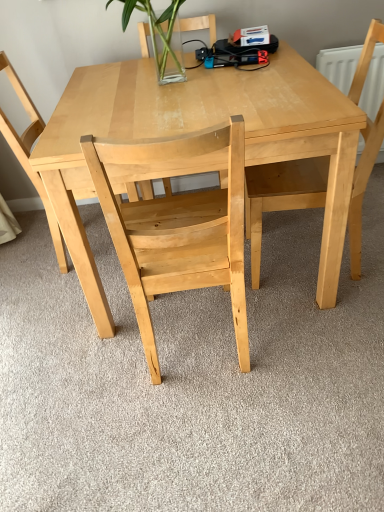
You are a GUI agent. You are given a task and a screenshot of the screen. Output one action in this format:
    pyautogui.click(x=<x>, y=<y>)
    Task: Click on the free space in front of natural wood chair at center, the 2th chair viewed from the left
    
    Given the screenshot: What is the action you would take?
    pyautogui.click(x=218, y=441)